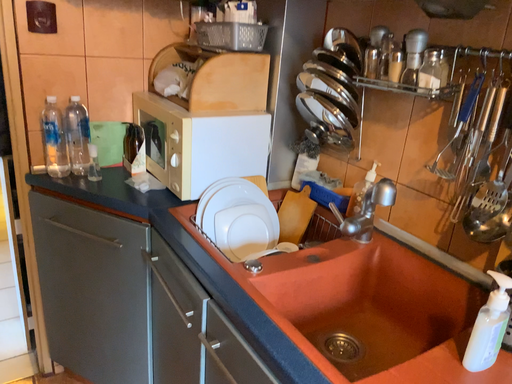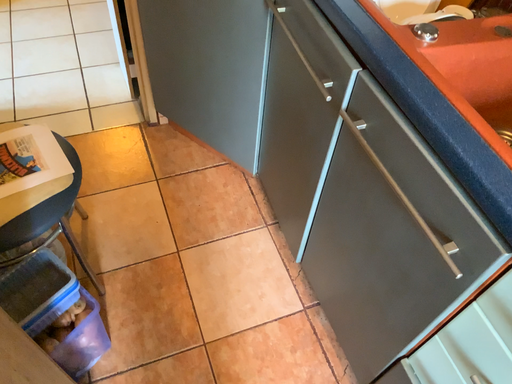
Question: Which way did the camera rotate in the video?

Choices:
 (A) rotated right
 (B) rotated left

Answer: (B)